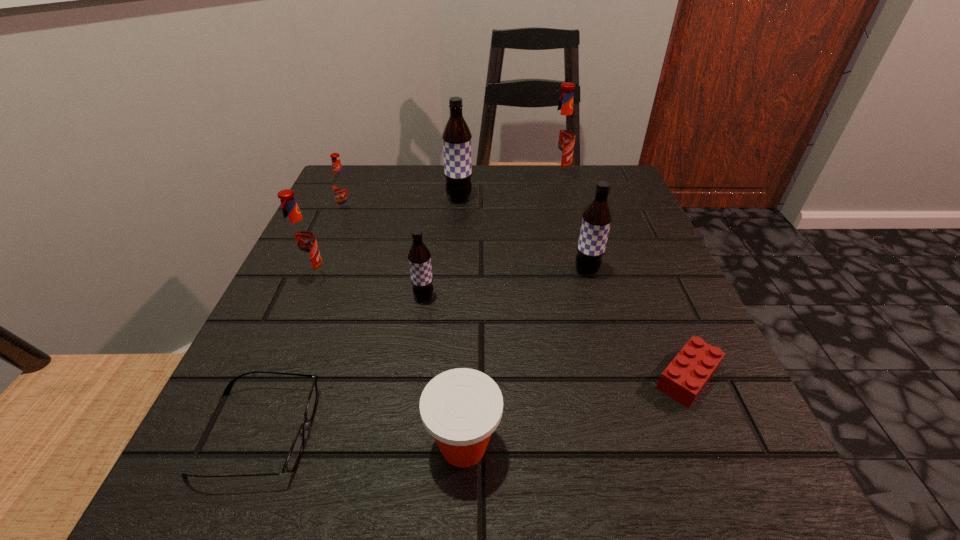
Locate an element on the screen. The height and width of the screenshot is (540, 960). object located at the near left corner is located at coordinates (295, 451).

You are a GUI agent. You are given a task and a screenshot of the screen. Output one action in this format:
    pyautogui.click(x=<x>, y=<y>)
    Task: Click on the object present at the far right corner
    
    Given the screenshot: What is the action you would take?
    pyautogui.click(x=561, y=138)

At what (x,y) coordinates should I click in order to perform the action: click on free location at the far edge of the desktop. Please return your answer as a coordinate pair (x, y). Looking at the image, I should click on (547, 192).

Identify the location of free spot at the near edge of the desktop. (537, 452).

You are a GUI agent. You are given a task and a screenshot of the screen. Output one action in this format:
    pyautogui.click(x=<x>, y=<y>)
    Task: Click on the free space at the left edge
    
    Given the screenshot: What is the action you would take?
    pyautogui.click(x=243, y=364)

This screenshot has width=960, height=540. Identify the location of vacant region at the right edge of the desktop. (622, 310).

In the image, there is a desktop. Where is `free space at the near left corner`? Image resolution: width=960 pixels, height=540 pixels. free space at the near left corner is located at coordinates (203, 521).

The width and height of the screenshot is (960, 540). What are the coordinates of `blank space at the far right corner` in the screenshot? It's located at (604, 166).

You are a GUI agent. You are given a task and a screenshot of the screen. Output one action in this format:
    pyautogui.click(x=<x>, y=<y>)
    Task: Click on the free point between the nearest red root beer and the spectacles
    Image resolution: width=960 pixels, height=540 pixels.
    Given the screenshot: What is the action you would take?
    pyautogui.click(x=285, y=356)

Find the location of `empty space that is in between the second biggest red root beer and the farthest brown root beer`. empty space that is in between the second biggest red root beer and the farthest brown root beer is located at coordinates click(x=386, y=238).